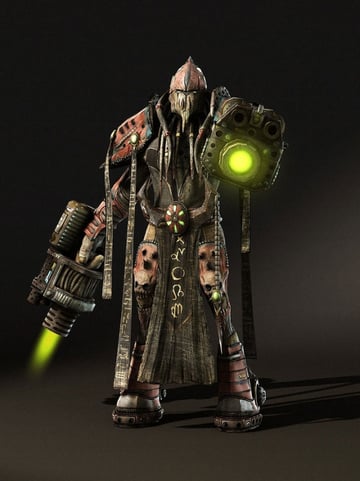
Identify the location of black floor. (150, 451).